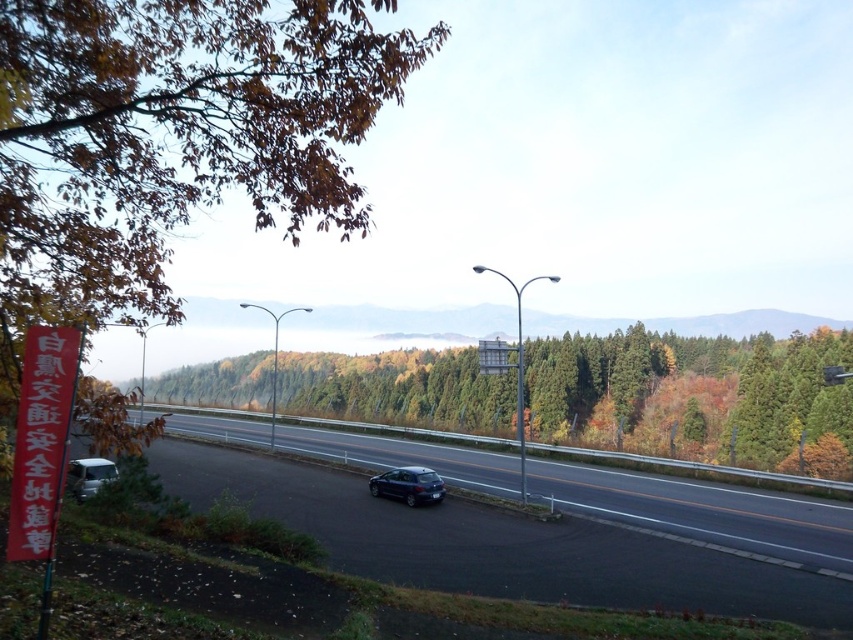
Between green matte tree at center and satin black hatchback at center, which one appears on the right side from the viewer's perspective?

green matte tree at center is more to the right.

Can you confirm if green matte tree at center is positioned to the right of satin black hatchback at center?

Indeed, green matte tree at center is positioned on the right side of satin black hatchback at center.

The height and width of the screenshot is (640, 853). In order to click on green matte tree at center in this screenshot , I will do `click(694, 396)`.

Identify the location of green matte tree at center. (694, 396).

Is brown leafy tree at upper left in front of black asphalt highway at center?

Yes, it is in front of black asphalt highway at center.

From the picture: Which of these two, brown leafy tree at upper left or black asphalt highway at center, stands shorter?

Standing shorter between the two is black asphalt highway at center.

Which is behind, point (140, 186) or point (561, 595)?

Point (561, 595)

I want to click on brown leafy tree at upper left, so click(x=171, y=140).

Does black asphalt highway at center appear on the left side of satin black hatchback at center?

Correct, you'll find black asphalt highway at center to the left of satin black hatchback at center.

Between black asphalt highway at center and satin black hatchback at center, which one appears on the right side from the viewer's perspective?

satin black hatchback at center

What do you see at coordinates (538, 529) in the screenshot? Image resolution: width=853 pixels, height=640 pixels. I see `black asphalt highway at center` at bounding box center [538, 529].

Locate an element on the screen. black asphalt highway at center is located at coordinates (538, 529).